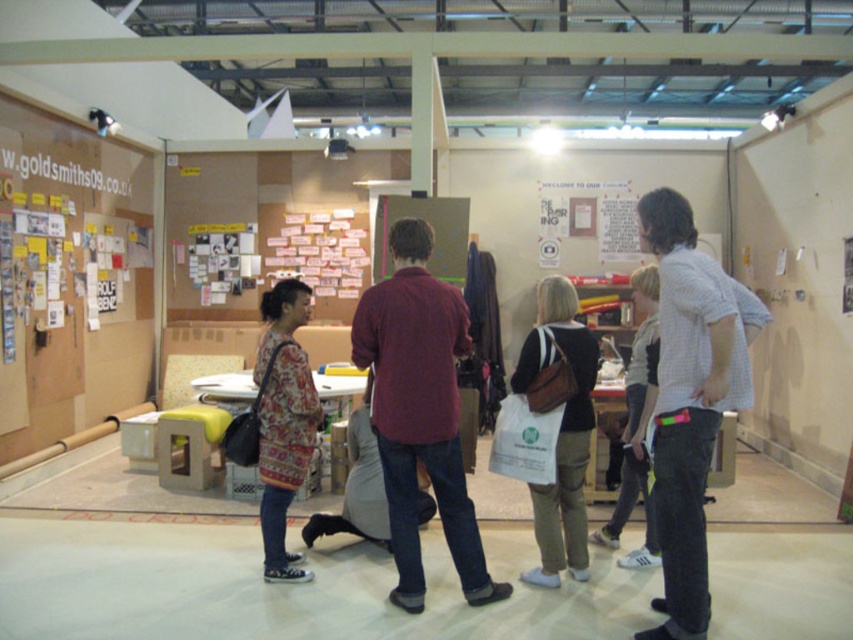
You are at an event and see a white canvas tote bag at center and a patterned fabric sweater at center. Which item is taller?

The white canvas tote bag at center is much taller than the patterned fabric sweater at center.